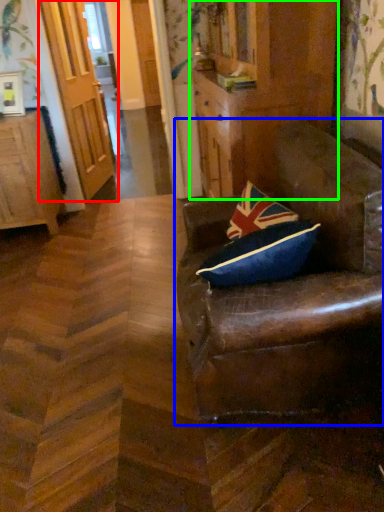
Question: Which is nearer to the door (highlighted by a red box)? chair (highlighted by a blue box) or dresser (highlighted by a green box).

Choices:
 (A) chair
 (B) dresser

Answer: (B)